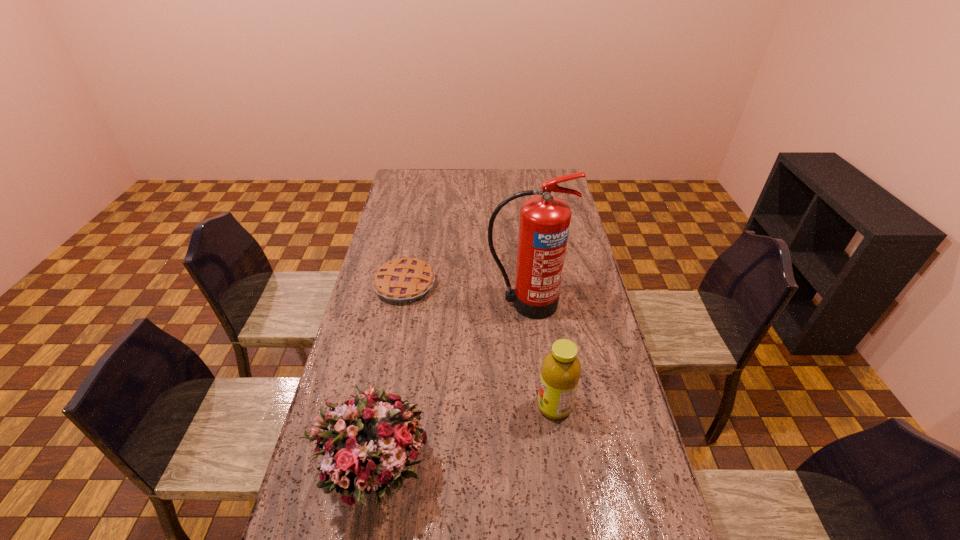
Where is `free space between the fruit juice and the fire extinguisher`? This screenshot has width=960, height=540. free space between the fruit juice and the fire extinguisher is located at coordinates (540, 355).

At what (x,y) coordinates should I click in order to perform the action: click on vacant space in between the pie and the tallest object. Please return your answer as a coordinate pair (x, y). The image size is (960, 540). Looking at the image, I should click on (466, 294).

What are the coordinates of `vacant space that is in between the shortest object and the fruit juice` in the screenshot? It's located at (480, 345).

You are a GUI agent. You are given a task and a screenshot of the screen. Output one action in this format:
    pyautogui.click(x=<x>, y=<y>)
    Task: Click on the vacant space that is in between the pie and the fruit juice
    
    Given the screenshot: What is the action you would take?
    pyautogui.click(x=480, y=345)

In order to click on free spot between the fruit juice and the pie in this screenshot , I will do `click(480, 345)`.

Find the location of a particular element. This screenshot has width=960, height=540. free space between the shortest object and the fruit juice is located at coordinates (480, 345).

Locate which object ranks third in proximity to the bouquet. Please provide its 2D coordinates. Your answer should be formatted as a tuple, i.e. [(x, y)], where the tuple contains the x and y coordinates of a point satisfying the conditions above.

[(402, 280)]

Locate an element on the screen. The height and width of the screenshot is (540, 960). object that is the second nearest to the fruit juice is located at coordinates (544, 224).

Locate an element on the screen. The height and width of the screenshot is (540, 960). free location that satisfies the following two spatial constraints: 1. on the front side of the bouquet; 2. on the left side of the pie is located at coordinates (370, 471).